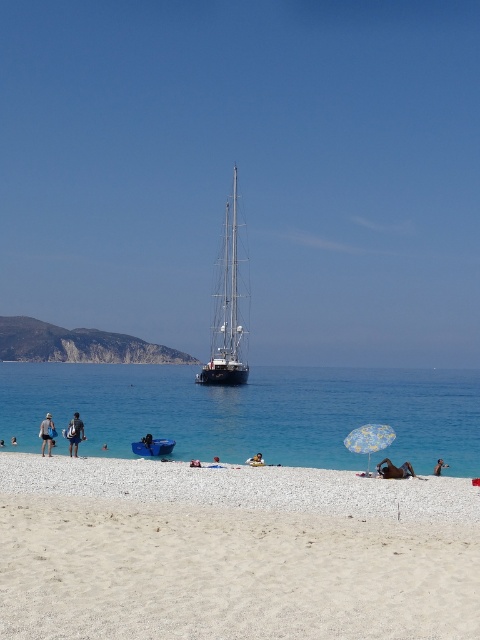
Question: Is khaki shorts at center above blue fabric swimmer at lower center?

Choices:
 (A) yes
 (B) no

Answer: (A)

Question: Does dark blue fabric umbrella at center appear over blue fabric swimmer at lower center?

Choices:
 (A) no
 (B) yes

Answer: (A)

Question: Based on their relative distances, which object is farther from the yellow printed fabric umbrella at lower right?

Choices:
 (A) blue matte sailboat at center
 (B) dark blue fabric umbrella at lower right

Answer: (A)

Question: Which object appears farthest from the camera in this image?

Choices:
 (A) blue water at lower center
 (B) tan skin person at lower right
 (C) dark blue fabric at center

Answer: (C)

Question: Can you confirm if tan skin person at center is thinner than dark blue swimwear at lower left?

Choices:
 (A) no
 (B) yes

Answer: (B)

Question: Which point is farther to the camera?

Choices:
 (A) (101, 445)
 (B) (49, 428)

Answer: (A)